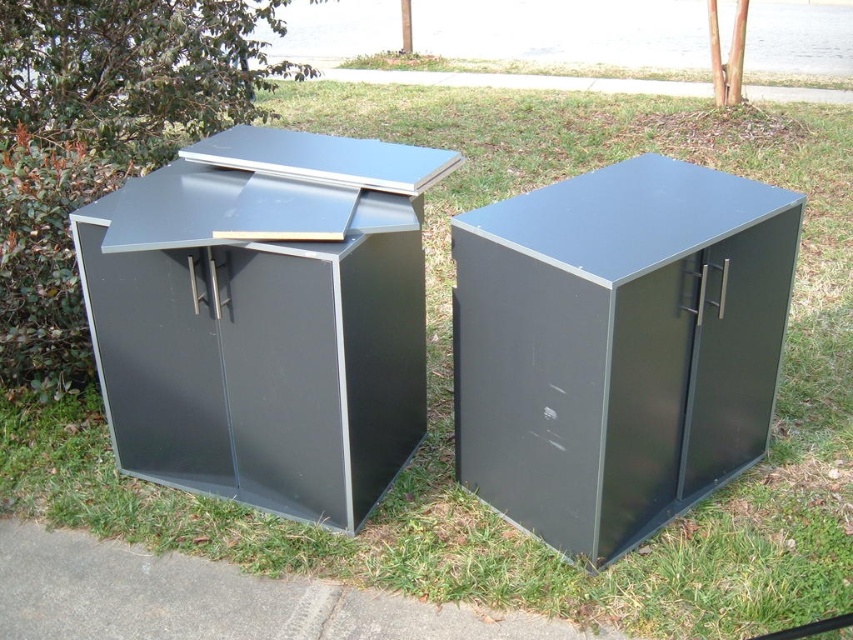
You are a delivery person trying to place a large box between the matte black cabinet at left and the matte black cabinet at center. Based on their positions, can you fit the box between them?

The matte black cabinet at center is behind the matte black cabinet at left, so there is no space between them for the box to fit.

You are standing in a park and see a matte black cabinet at center. If you want to place a 1.5 meter long wooden bench in front of it without moving the cabinet, will there be enough space?

The matte black cabinet at center is 1.73 meters from viewer. Since the bench is 1.5 meters long, there is sufficient space to place it in front of the cabinet as the distance from the viewer to the cabinet is greater than the bench length.

You are standing at the origin point of the image. Which direction should you move to reach the matte black cabinet at left?

The matte black cabinet at left is located at point 0.497 on the x axis and 0.311 on the y axis. Since the origin point is at the bottom left corner of the image, moving towards the right along the x axis and slightly upwards along the y axis would lead you to the matte black cabinet at left.